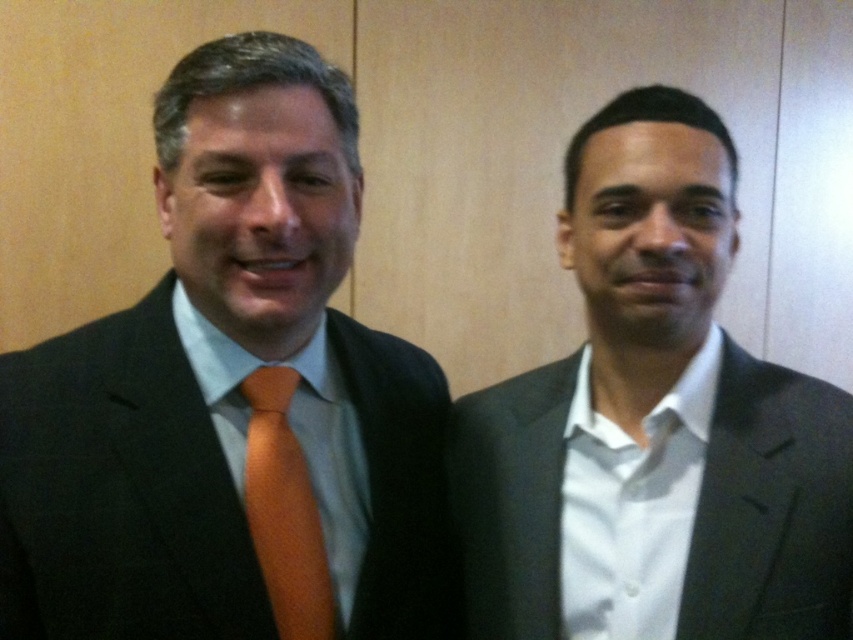
You are an AI analyzing a photograph of two people standing against a wooden wall. The image has a coordinate system where the bottom left corner is the origin. The person on the left is wearing a matte black suit. What are the coordinates of the matte black suit at left?

The coordinates of the matte black suit at left are at point [231,400].

You are a photographer setting up for a formal event. You need to adjust the lighting so that the matte black suit at right and orange satin tie at left are equally illuminated. Given their positions, which object should you focus the light on more to achieve this?

The matte black suit at right is located above the orange satin tie at left. Since the orange satin tie at left is lower, you should focus more light on the lower area where the orange satin tie at left is positioned to ensure both receive equal illumination.